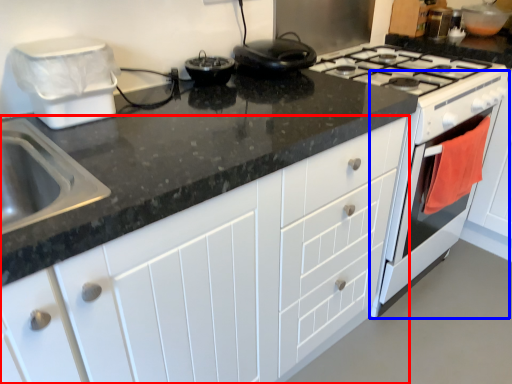
Question: Which point is further to the camera, cabinetry (highlighted by a red box) or oven (highlighted by a blue box)?

Choices:
 (A) cabinetry
 (B) oven

Answer: (B)